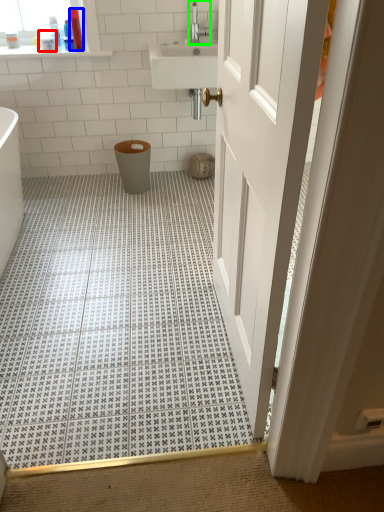
Question: Which object is positioned farthest from toiletry (highlighted by a red box)? Select from toiletry (highlighted by a blue box) and tap (highlighted by a green box).

Choices:
 (A) toiletry
 (B) tap

Answer: (B)